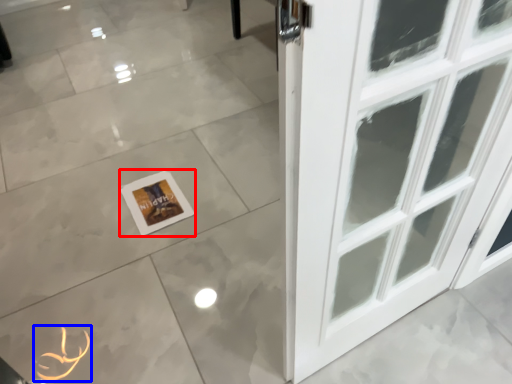
Question: Which object is closer to the camera taking this photo, picture frame (highlighted by a red box) or print (highlighted by a blue box)?

Choices:
 (A) picture frame
 (B) print

Answer: (B)